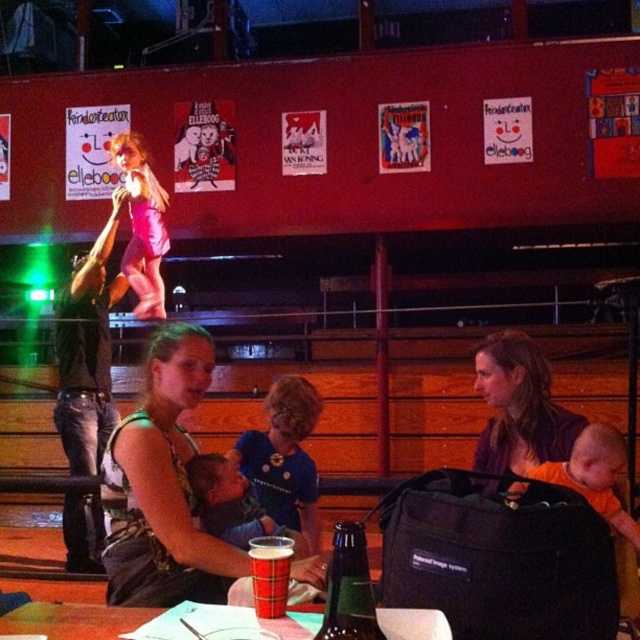
You are organizing a community event and need to place a new sign on the table. The sign requires 10 cm of space to the right of the camouflage fabric baby carrier at center. Is there enough space available on the table for this sign?

The camouflage fabric baby carrier at center is located at point (163, 486). However, without knowing the dimensions of the table or the space to the right of the carrier, it is impossible to determine if there is enough space for the 10 cm sign requirement.

You are organizing a baby care workshop and have a table with a camouflage fabric baby carrier at center and a green glass bottle at center. You need to place a new item between them that requires more space than the narrower of the two. Which item should you compare the width to ensure the new item fits?

You should compare the width to the green glass bottle at center because the camouflage fabric baby carrier at center might be wider than the green glass bottle at center, so the narrower item is the green glass bottle at center.

You are organizing a small event and need to place a decorative item at position point 0.920, 0.545. Is the green glass bottle at center already occupying that location?

Yes, the green glass bottle at center is located at point (x=348, y=588), so it is already occupying that location.